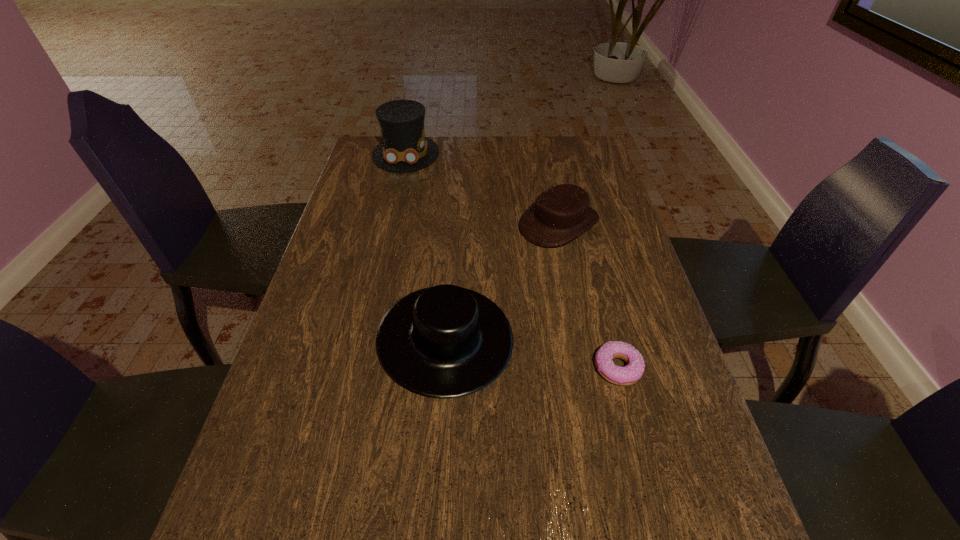
Find the location of a particular element. The image size is (960, 540). vacant region located on the back of the shortest object is located at coordinates (604, 314).

Identify the location of object located in the far edge section of the desktop. This screenshot has height=540, width=960. (404, 148).

Identify the location of object located in the left edge section of the desktop. (404, 148).

Image resolution: width=960 pixels, height=540 pixels. Find the location of `hat that is positioned at the right edge`. hat that is positioned at the right edge is located at coordinates (560, 214).

Where is `doughnut that is at the right edge`? The height and width of the screenshot is (540, 960). doughnut that is at the right edge is located at coordinates (632, 372).

This screenshot has height=540, width=960. In order to click on object present at the far left corner in this screenshot , I will do `click(404, 148)`.

Where is `free space at the far edge`? This screenshot has height=540, width=960. free space at the far edge is located at coordinates (463, 151).

Locate an element on the screen. vacant space at the left edge is located at coordinates (318, 460).

You are a GUI agent. You are given a task and a screenshot of the screen. Output one action in this format:
    pyautogui.click(x=<x>, y=<y>)
    Task: Click on the free location at the right edge
    The height and width of the screenshot is (540, 960).
    Given the screenshot: What is the action you would take?
    pyautogui.click(x=607, y=310)

The width and height of the screenshot is (960, 540). In order to click on free location at the far left corner in this screenshot , I will do `click(366, 159)`.